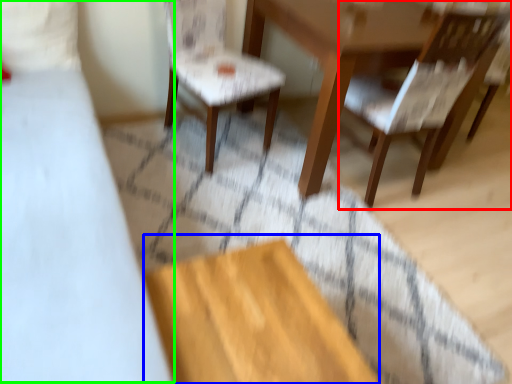
Question: Based on their relative distances, which object is farther from chair (highlighted by a red box)? Choose from plywood (highlighted by a blue box) and bed (highlighted by a green box).

Choices:
 (A) plywood
 (B) bed

Answer: (B)